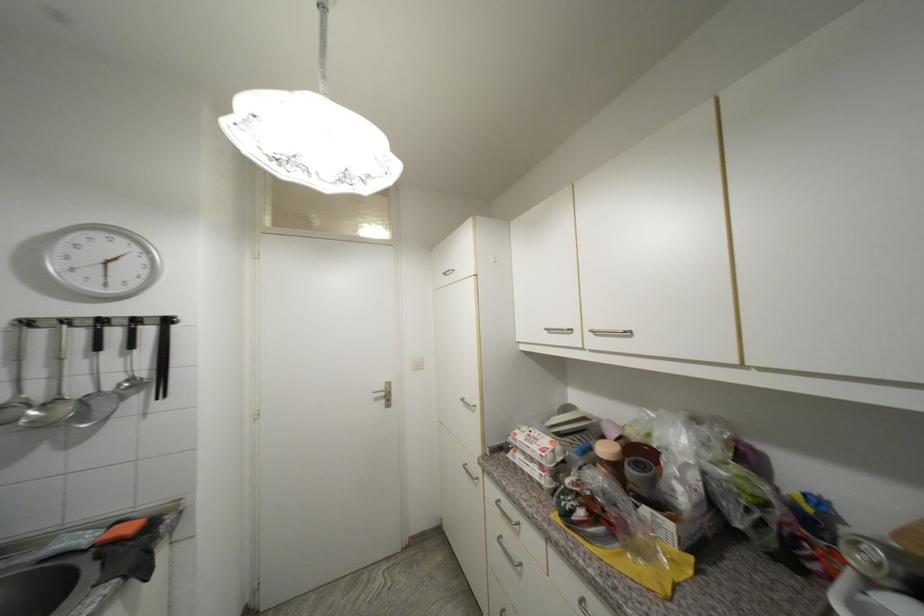
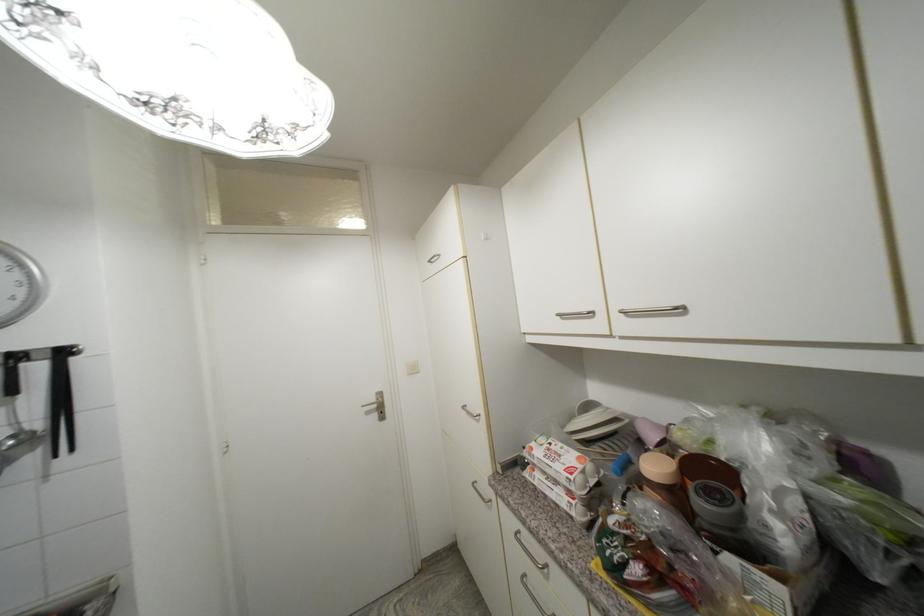
Question: Based on the continuous images, in which direction is the camera rotating? Reply with the corresponding letter.

Choices:
 (A) Left
 (B) Right
 (C) Up
 (D) Down

Answer: (D)